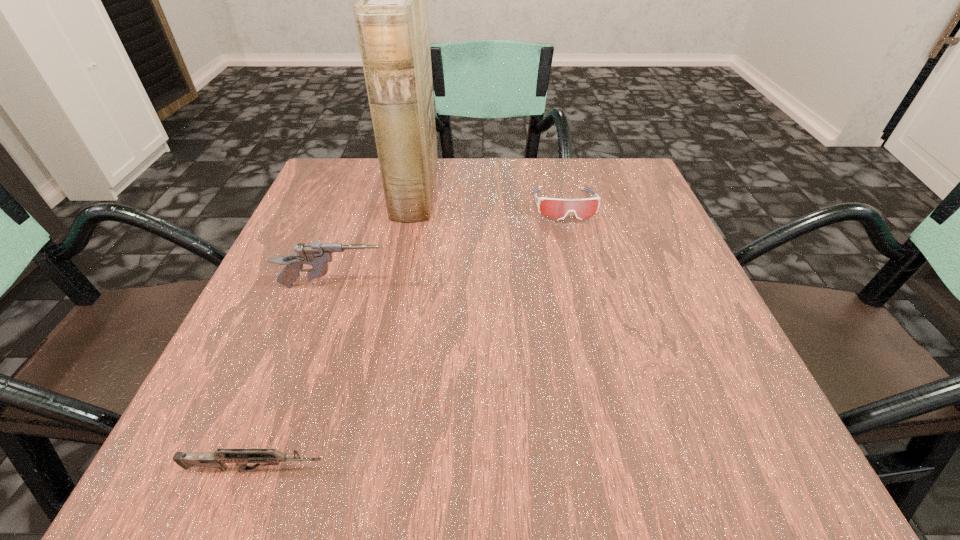
The image size is (960, 540). In order to click on free space at the far left corner of the desktop in this screenshot , I will do `click(365, 165)`.

This screenshot has height=540, width=960. In the image, there is a desktop. Identify the location of vacant space at the near left corner. (281, 420).

What are the coordinates of `vacant space at the far right corner` in the screenshot? It's located at (602, 160).

What are the coordinates of `free space at the near right corner` in the screenshot? It's located at (742, 470).

This screenshot has width=960, height=540. Find the location of `unoccupied position between the nearest object and the tallest object`. unoccupied position between the nearest object and the tallest object is located at coordinates (336, 330).

Identify the location of free space that is in between the phonebook and the goggles. (490, 198).

This screenshot has width=960, height=540. I want to click on unoccupied position between the nearest object and the rightmost object, so click(411, 338).

The image size is (960, 540). Find the location of `free space between the taller gun and the tallest object`. free space between the taller gun and the tallest object is located at coordinates (374, 238).

Locate an element on the screen. free area in between the goggles and the tallest object is located at coordinates (490, 198).

This screenshot has height=540, width=960. I want to click on free space between the rightmost object and the phonebook, so click(x=490, y=198).